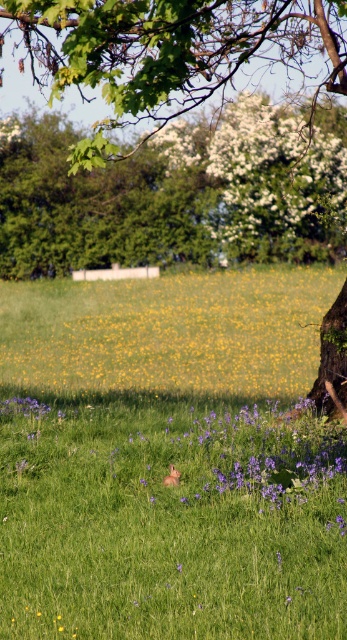
Question: Can you confirm if brown furry rabbit at center is smaller than yellow matte flower at center?

Choices:
 (A) yes
 (B) no

Answer: (A)

Question: Considering the real-world distances, which object is closest to the white matte flower at upper center?

Choices:
 (A) brown furry rabbit at center
 (B) brown textured tree at center right

Answer: (B)

Question: Which object is the closest to the yellow matte flower at center?

Choices:
 (A) brown textured tree at center right
 (B) brown furry rabbit at center
 (C) white matte flower at upper center

Answer: (A)

Question: Which point is farther to the camera?

Choices:
 (A) (334, 92)
 (B) (230, 163)

Answer: (B)

Question: Is yellow matte flower at center wider than brown textured tree at center right?

Choices:
 (A) no
 (B) yes

Answer: (A)

Question: Observing the image, what is the correct spatial positioning of brown furry rabbit at center in reference to yellow matte flower at center?

Choices:
 (A) right
 (B) left

Answer: (A)